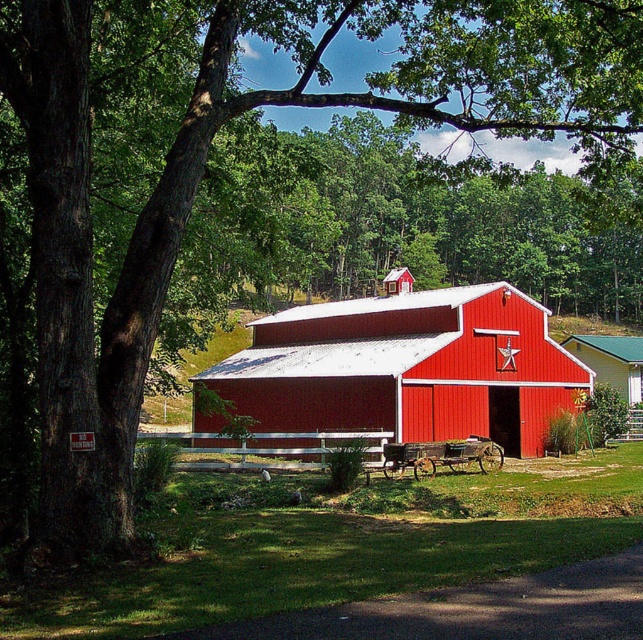
Does smooth red barn at center have a smaller size compared to red matte barn at center?

No, smooth red barn at center is not smaller than red matte barn at center.

Which is behind, point (430, 292) or point (635, 387)?

The point (635, 387) is more distant.

At what (x,y) coordinates should I click in order to perform the action: click on smooth red barn at center. Please return your answer as a coordinate pair (x, y). Looking at the image, I should click on coord(406,368).